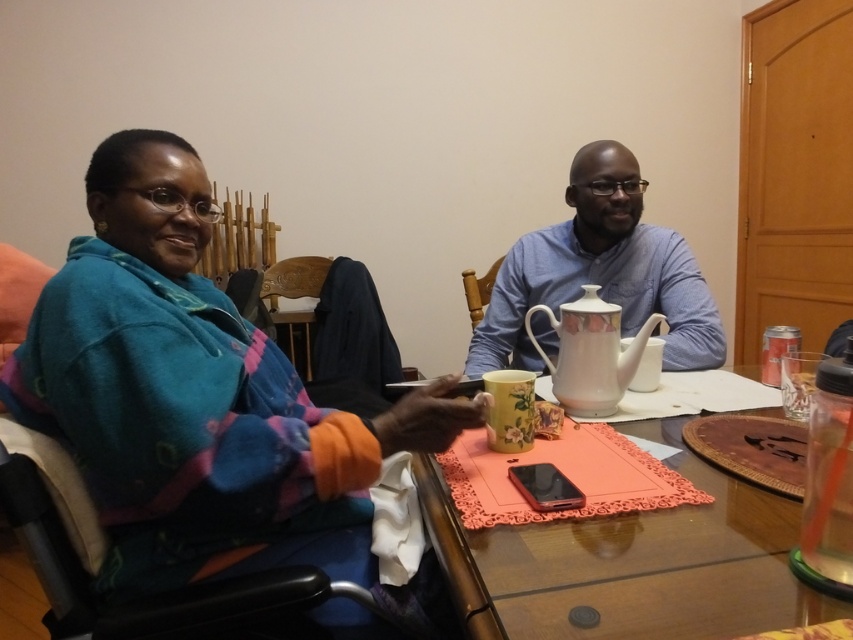
Question: Which is farther from the matte plastic phone at center?

Choices:
 (A) blue cotton shirt at center
 (B) blue fleece jacket at left

Answer: (A)

Question: Does blue fleece jacket at left have a larger size compared to matte plastic phone at center?

Choices:
 (A) yes
 (B) no

Answer: (A)

Question: Can you confirm if matte plastic phone at center is bigger than blue cotton shirt at center?

Choices:
 (A) no
 (B) yes

Answer: (A)

Question: Is blue fleece jacket at left wider than matte plastic phone at center?

Choices:
 (A) no
 (B) yes

Answer: (B)

Question: Which of the following is the farthest from the observer?

Choices:
 (A) 546,298
 (B) 67,413

Answer: (A)

Question: Among these points, which one is farthest from the camera?

Choices:
 (A) (538, 592)
 (B) (572, 266)

Answer: (B)